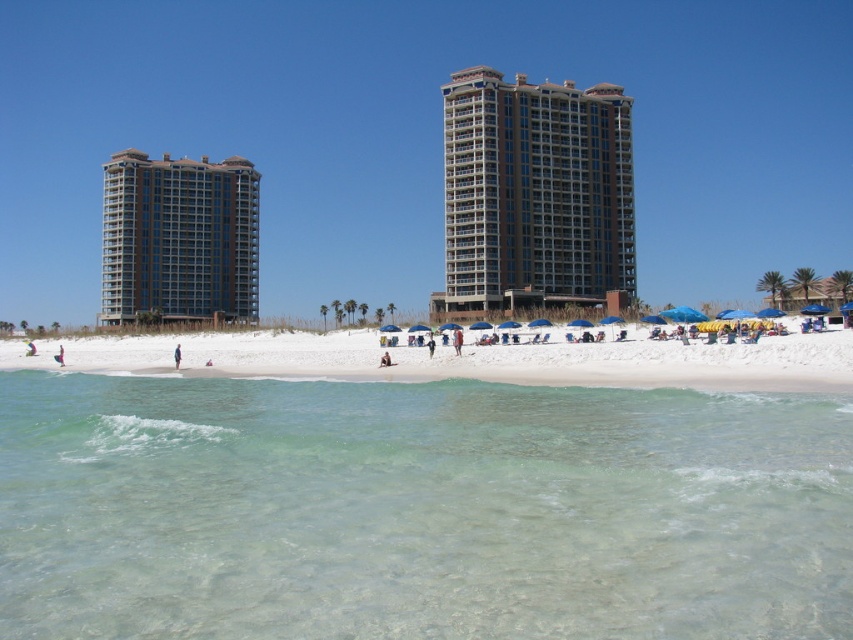
Question: Where is blue fabric person at center located in relation to pink fabric person at lower left in the image?

Choices:
 (A) left
 (B) right

Answer: (B)

Question: Observing the image, what is the correct spatial positioning of brown glassy building at center in reference to white sandy beach at center?

Choices:
 (A) left
 (B) right

Answer: (B)

Question: Which object appears closest to the camera in this image?

Choices:
 (A) brown glassy building at center
 (B) clear water at lower center
 (C) white sandy beach at center
 (D) pink fabric person at lower left

Answer: (B)

Question: Does clear water at lower center appear over brown glassy building at center?

Choices:
 (A) no
 (B) yes

Answer: (A)

Question: Which point appears farthest from the camera in this image?

Choices:
 (A) (28, 353)
 (B) (584, 628)
 (C) (173, 352)

Answer: (A)

Question: Among these points, which one is nearest to the camera?

Choices:
 (A) (473, 356)
 (B) (177, 356)
 (C) (28, 344)
 (D) (616, 145)

Answer: (A)